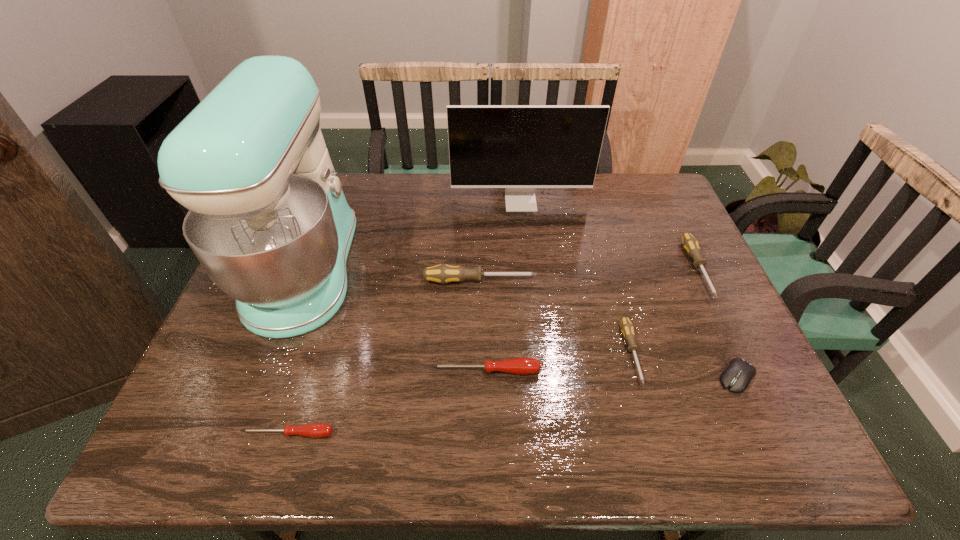
Find the location of `the nearest gray screwdriver`. the nearest gray screwdriver is located at coordinates click(x=627, y=328).

You are a GUI agent. You are given a task and a screenshot of the screen. Output one action in this format:
    pyautogui.click(x=<x>, y=<y>)
    Task: Click on the smallest gray screwdriver
    This screenshot has width=960, height=540.
    Given the screenshot: What is the action you would take?
    pyautogui.click(x=627, y=328)

What are the coordinates of `black computer equipment` in the screenshot? It's located at (737, 376).

Find the location of a particular element. the shortest screwdriver is located at coordinates (315, 430).

This screenshot has height=540, width=960. I want to click on the nearest screwdriver, so click(315, 430).

Locate an element on the screen. Image resolution: width=960 pixels, height=540 pixels. vacant space located 0.250m at the base of the mixer is located at coordinates (452, 269).

In order to click on free spot located on the front-facing side of the monitor in this screenshot , I will do `click(524, 237)`.

The height and width of the screenshot is (540, 960). I want to click on blank area located 0.310m at the tip of the biggest gray screwdriver, so [x=655, y=281].

Where is `free spot located 0.350m at the tip of the second biggest gray screwdriver`? free spot located 0.350m at the tip of the second biggest gray screwdriver is located at coordinates (779, 438).

I want to click on free space located on the right of the right red screwdriver, so click(x=622, y=371).